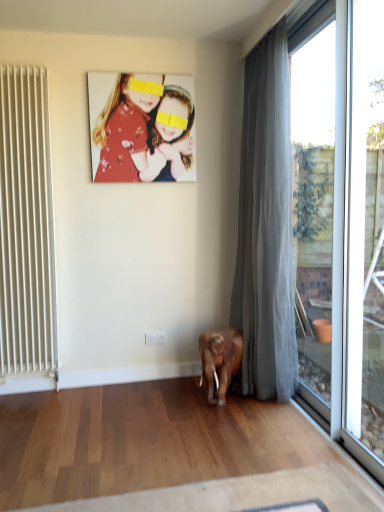
The image size is (384, 512). I want to click on transparent glass window at right, acting as the 1th window frame starting from the back, so click(314, 203).

The width and height of the screenshot is (384, 512). Describe the element at coordinates (26, 226) in the screenshot. I see `white matte radiator at left` at that location.

Find the location of `gray sheer curtain at right`. gray sheer curtain at right is located at coordinates (266, 228).

Where is `power outlet on the right of the white matte radiator at left`? Image resolution: width=384 pixels, height=512 pixels. power outlet on the right of the white matte radiator at left is located at coordinates (155, 337).

Which is correct: white plastic power outlet at lower center is inside white matte radiator at left, or outside of it?

white plastic power outlet at lower center is located beyond the bounds of white matte radiator at left.

Between white plastic power outlet at lower center and white matte radiator at left, which one has smaller size?

Smaller between the two is white plastic power outlet at lower center.

From the image's perspective, is floral fabric photo at upper center on gray sheer curtain at right?

Yes, from the image's perspective, floral fabric photo at upper center is above gray sheer curtain at right.

From a real-world perspective, which object rests below the other?

From a 3D spatial view, gray sheer curtain at right is below.

Consider the image. Is floral fabric photo at upper center bigger or smaller than gray sheer curtain at right?

In the image, floral fabric photo at upper center appears to be smaller than gray sheer curtain at right.

From a real-world perspective, who is located higher, white plastic window frame at right, which appears as the 2th window frame when viewed from the back, or transparent glass window at right, which is the second window frame in front-to-back order?

In real-world perspective, transparent glass window at right, which is the second window frame in front-to-back order, is above.

Looking at this image, considering the relative sizes of white plastic window frame at right, which appears as the 2th window frame when viewed from the back, and transparent glass window at right, which is the second window frame in front-to-back order, in the image provided, is white plastic window frame at right, which appears as the 2th window frame when viewed from the back, thinner than transparent glass window at right, which is the second window frame in front-to-back order,?

No.

Does white plastic window frame at right, which appears as the 2th window frame when viewed from the back, appear on the right side of transparent glass window at right, acting as the 1th window frame starting from the back?

Yes.

Between white plastic power outlet at lower center and floral fabric photo at upper center, which one has smaller width?

With smaller width is white plastic power outlet at lower center.

Could you tell me if white plastic power outlet at lower center is turned towards floral fabric photo at upper center?

No, white plastic power outlet at lower center is not turned towards floral fabric photo at upper center.

From a real-world perspective, is white plastic power outlet at lower center physically above floral fabric photo at upper center?

Actually, white plastic power outlet at lower center is physically below floral fabric photo at upper center in the real world.

Does white plastic window frame at right, which appears as the 2th window frame when viewed from the back, appear on the right side of white plastic power outlet at lower center?

Indeed, white plastic window frame at right, which appears as the 2th window frame when viewed from the back, is positioned on the right side of white plastic power outlet at lower center.

In the scene shown: From the image's perspective, between white plastic window frame at right, which appears as the 2th window frame when viewed from the back, and white plastic power outlet at lower center, which one is located above?

white plastic window frame at right, which appears as the 2th window frame when viewed from the back, appears higher in the image.

Which object is wider, white plastic window frame at right, which is the first window frame from front to back, or white plastic power outlet at lower center?

white plastic window frame at right, which is the first window frame from front to back.

Considering the positions of point (162, 331) and point (361, 393), is point (162, 331) closer or farther from the camera than point (361, 393)?

Point (162, 331) is farther from the camera than point (361, 393).

Identify the location of the 2nd window frame to the right when counting from the white plastic power outlet at lower center. (364, 238).

From a real-world perspective, does white plastic power outlet at lower center sit lower than white plastic window frame at right, which appears as the 2th window frame when viewed from the back?

Indeed, from a real-world perspective, white plastic power outlet at lower center is positioned beneath white plastic window frame at right, which appears as the 2th window frame when viewed from the back.

Does transparent glass window at right, acting as the 1th window frame starting from the back, turn towards white plastic power outlet at lower center?

No, transparent glass window at right, acting as the 1th window frame starting from the back, does not turn towards white plastic power outlet at lower center.

Which is closer to the camera, (299, 220) or (152, 335)?

Point (299, 220) appears to be farther away from the viewer than point (152, 335).

From the picture: Is transparent glass window at right, which is the second window frame in front-to-back order, bigger than white plastic power outlet at lower center?

Yes.

You are a GUI agent. You are given a task and a screenshot of the screen. Output one action in this format:
    pyautogui.click(x=<x>, y=<y>)
    Task: Click on the power outlet on the right of white matte radiator at left
    The image size is (384, 512).
    Given the screenshot: What is the action you would take?
    pyautogui.click(x=155, y=337)

Identify the location of person lying on the left of gray sheer curtain at right. This screenshot has width=384, height=512. (142, 127).

From the image, which object appears to be nearer to transparent glass window at right, acting as the 1th window frame starting from the back, white plastic power outlet at lower center or gray sheer curtain at right?

Among the two, gray sheer curtain at right is located nearer to transparent glass window at right, acting as the 1th window frame starting from the back.

Which object lies further to the anchor point floral fabric photo at upper center, white plastic power outlet at lower center or white matte radiator at left?

white plastic power outlet at lower center.

Estimate the real-world distances between objects in this image. Which object is further from gray sheer curtain at right, white plastic power outlet at lower center or white plastic window frame at right, which is the first window frame from front to back?

Among the two, white plastic power outlet at lower center is located further to gray sheer curtain at right.

Which object lies further to the anchor point floral fabric photo at upper center, white matte radiator at left or white plastic power outlet at lower center?

The object further to floral fabric photo at upper center is white plastic power outlet at lower center.

Considering their positions, is white matte radiator at left positioned closer to white plastic power outlet at lower center than transparent glass window at right, which is the second window frame in front-to-back order?

Among the two, white matte radiator at left is located nearer to white plastic power outlet at lower center.

Estimate the real-world distances between objects in this image. Which object is closer to floral fabric photo at upper center, white plastic window frame at right, which is the first window frame from front to back, or gray sheer curtain at right?

The object closer to floral fabric photo at upper center is gray sheer curtain at right.

Based on their spatial positions, is transparent glass window at right, which is the second window frame in front-to-back order, or white matte radiator at left closer to floral fabric photo at upper center?

Based on the image, white matte radiator at left appears to be nearer to floral fabric photo at upper center.

Estimate the real-world distances between objects in this image. Which object is closer to white plastic window frame at right, which appears as the 2th window frame when viewed from the back, white matte radiator at left or gray sheer curtain at right?

The object closer to white plastic window frame at right, which appears as the 2th window frame when viewed from the back, is gray sheer curtain at right.

Identify the location of window frame between white matte radiator at left and white plastic window frame at right, which is the first window frame from front to back, in the horizontal direction. This screenshot has height=512, width=384. (314, 203).

I want to click on power outlet between white matte radiator at left and white plastic window frame at right, which is the first window frame from front to back, so click(155, 337).

Identify the location of person between white plastic window frame at right, which is the first window frame from front to back, and white plastic power outlet at lower center in the front-back direction. This screenshot has height=512, width=384. (142, 127).

Image resolution: width=384 pixels, height=512 pixels. What are the coordinates of `window frame located between white plastic window frame at right, which is the first window frame from front to back, and gray sheer curtain at right in the depth direction` in the screenshot? It's located at (314, 203).